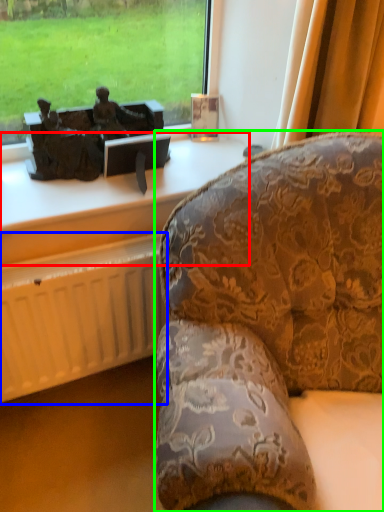
Question: Considering the real-world distances, which object is closest to furniture (highlighted by a red box)? radiator (highlighted by a blue box) or studio couch (highlighted by a green box).

Choices:
 (A) radiator
 (B) studio couch

Answer: (A)